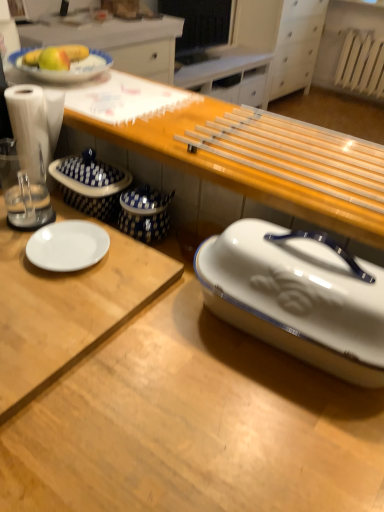
This screenshot has width=384, height=512. I want to click on free location to the left of white glossy breadbox at lower right, so click(165, 349).